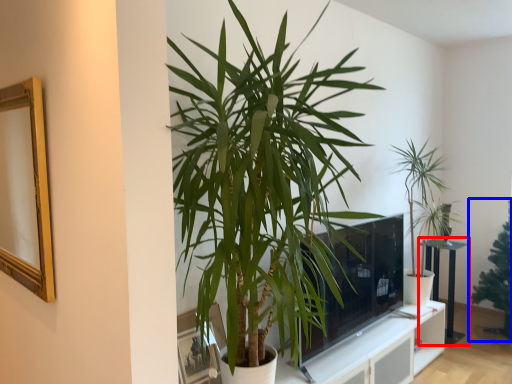
Question: Among these objects, which one is farthest to the camera, table (highlighted by a red box) or houseplant (highlighted by a blue box)?

Choices:
 (A) table
 (B) houseplant

Answer: (A)